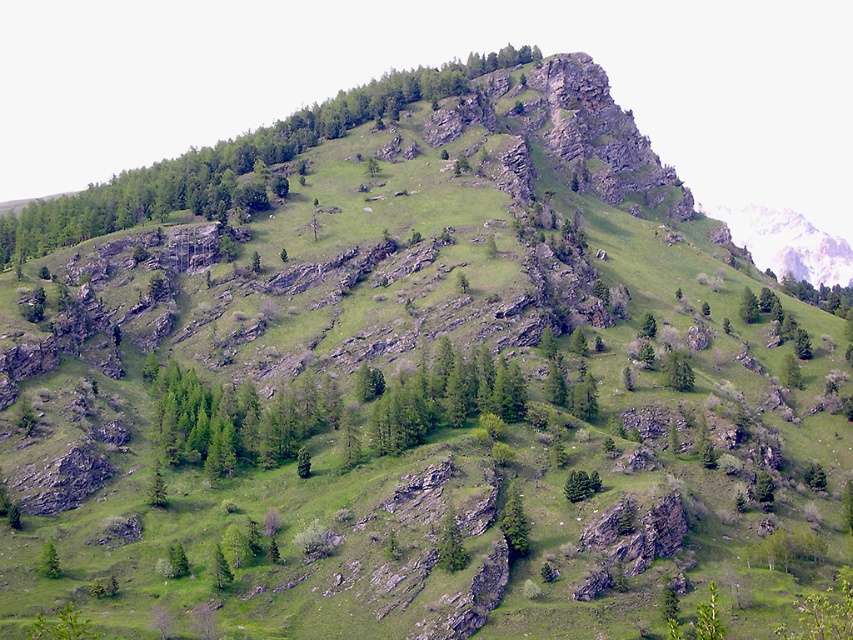
Is green leafy tree at upper center thinner than green matte tree at center?

No.

In the scene shown: Is green leafy tree at upper center to the left of green matte tree at center from the viewer's perspective?

Yes, green leafy tree at upper center is to the left of green matte tree at center.

Is point (36, 237) farther from camera compared to point (515, 532)?

Yes, point (36, 237) is behind point (515, 532).

The width and height of the screenshot is (853, 640). What are the coordinates of `green leafy tree at upper center` in the screenshot? It's located at (231, 157).